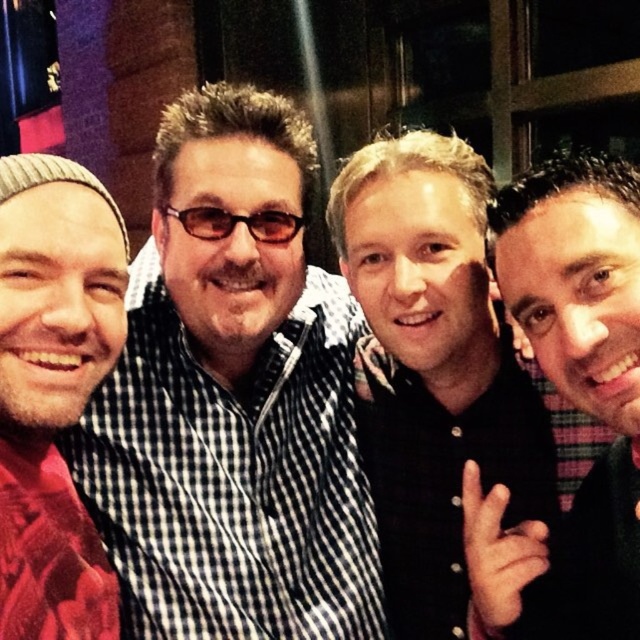
Question: In this image, where is checkered fabric shirt at center located relative to black matte shirt at center?

Choices:
 (A) below
 (B) above

Answer: (B)

Question: Which object is positioned farthest from the checkered fabric shirt at center?

Choices:
 (A) black button-up shirt at right
 (B) black matte shirt at center

Answer: (A)

Question: Which of the following is the farthest from the observer?

Choices:
 (A) red plaid shirt at left
 (B) black button-up shirt at right
 (C) black matte shirt at center
 (D) checkered fabric shirt at center

Answer: (D)

Question: Is the position of black matte shirt at center more distant than that of black button-up shirt at right?

Choices:
 (A) yes
 (B) no

Answer: (A)

Question: Does black matte shirt at center appear over black button-up shirt at right?

Choices:
 (A) yes
 (B) no

Answer: (B)

Question: Among these objects, which one is nearest to the camera?

Choices:
 (A) red plaid shirt at left
 (B) checkered fabric shirt at center
 (C) black button-up shirt at right

Answer: (A)